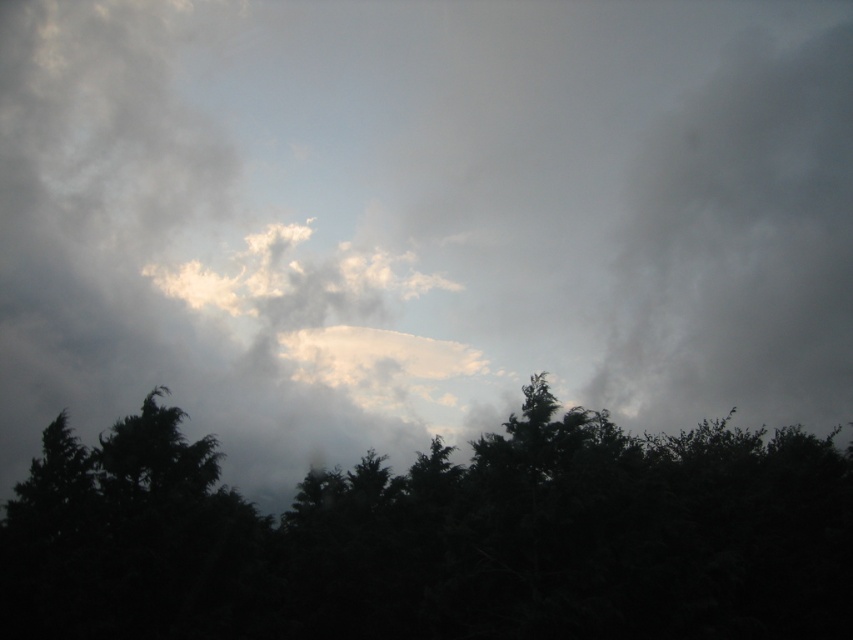
You are an astronomer analyzing the image of the sky. You notice two points of light labeled as point [845,609] and point [624,228]. Based on their positions, which point is closer to your observation point?

Point [845,609] is closer to the viewer than point [624,228], so the point [845,609] is closer to your observation point.

You are an astronomer observing the sky. You notice the dark green foliage at center and the dark gray cloud at right. Which object is positioned lower in the image?

The dark green foliage at center is located below the dark gray cloud at right, so it is positioned lower in the image.

You are an ornithologist observing birds in a forest. You notice two elements in the sky scene described above. Which object is wider between the dark green foliage at center and the dark gray cloud at right?

The dark green foliage at center is wider than the dark gray cloud at right according to the description.